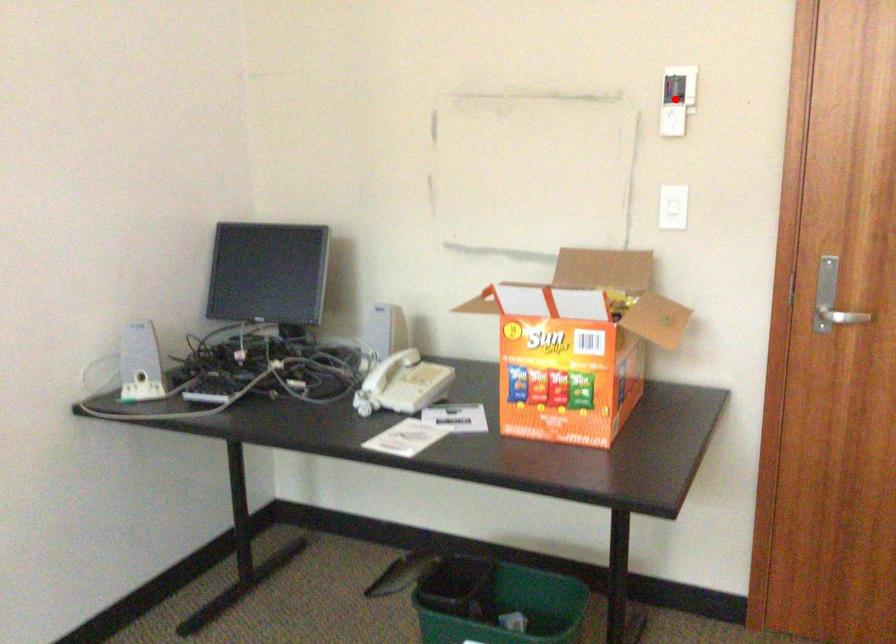
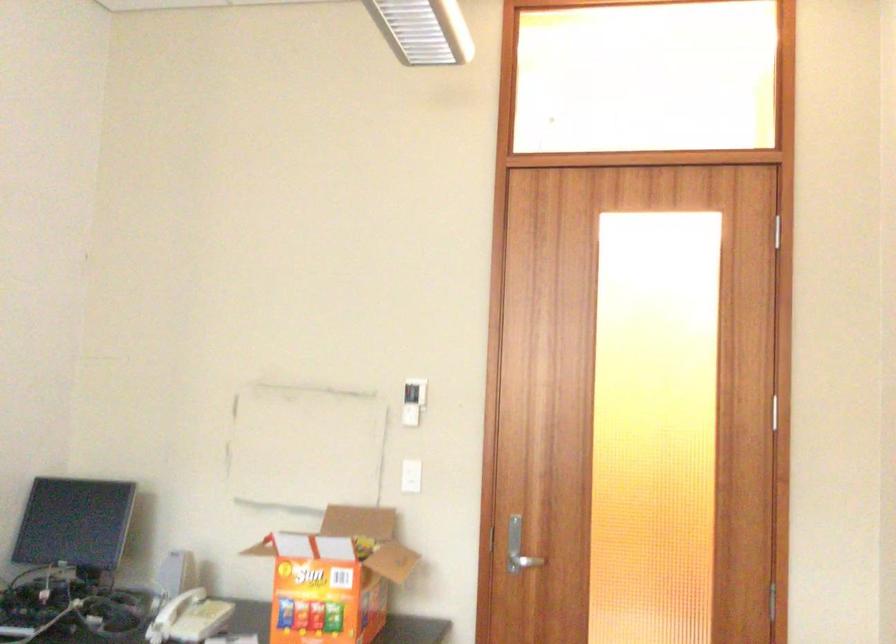
In the second image, find the point that corresponds to the highlighted location in the first image.

(412, 401)